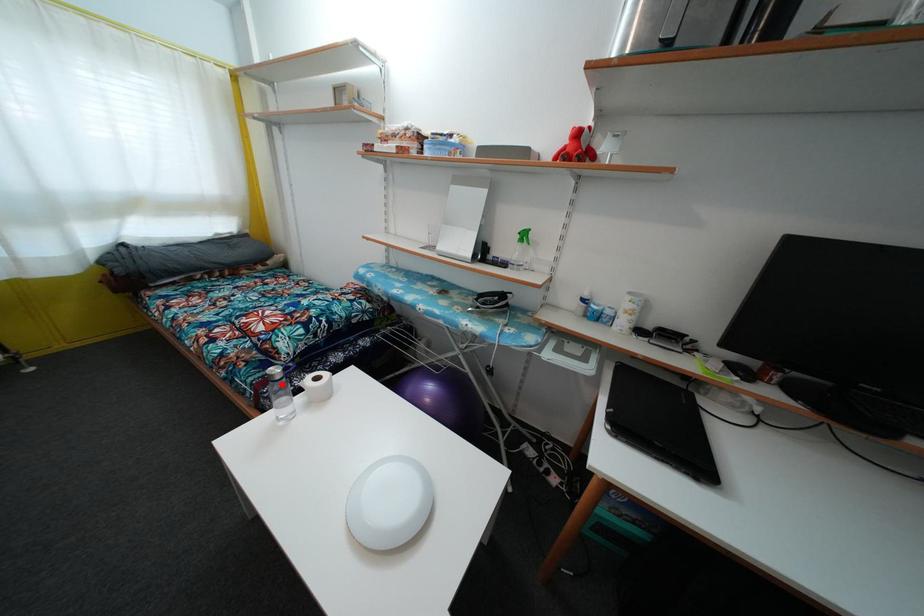
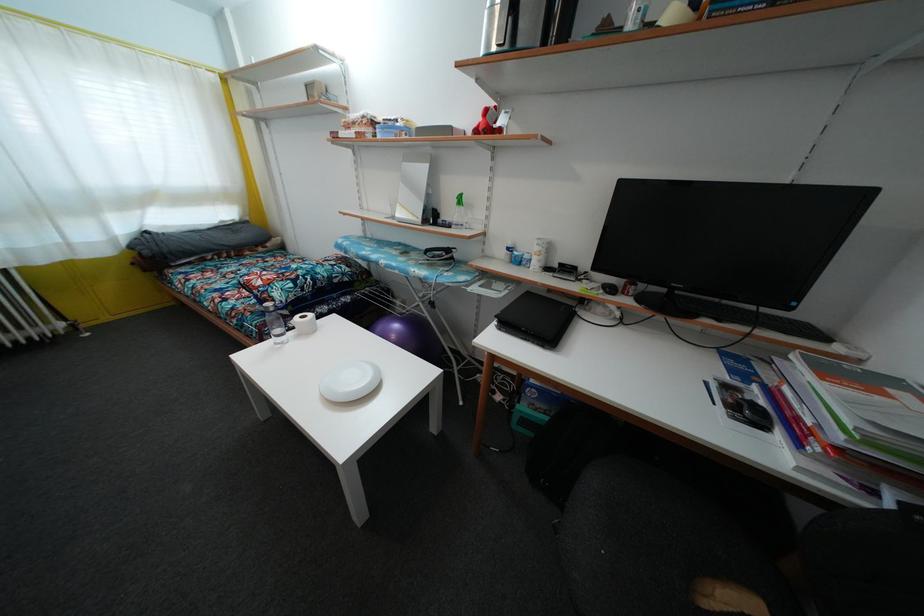
Question: A red point is marked in image1. In image2, is the corresponding 3D point closer to the camera or farther? Reply with the corresponding letter.

Choices:
 (A) The corresponding 3D point is closer.
 (B) The corresponding 3D point is farther.

Answer: (B)